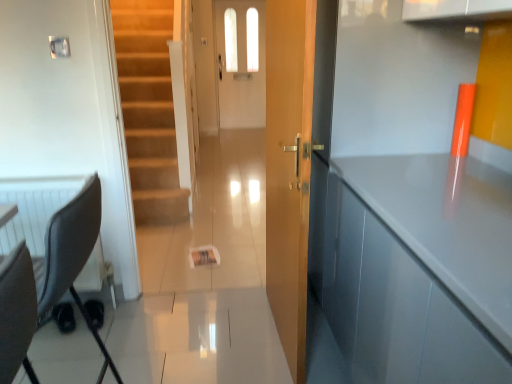
Question: From the image's perspective, does glossy gray cabinet at right appear higher than white glossy door at center?

Choices:
 (A) yes
 (B) no

Answer: (B)

Question: Is glossy gray cabinet at right shorter than white glossy door at center?

Choices:
 (A) no
 (B) yes

Answer: (B)

Question: Can white glossy door at center be found inside glossy gray cabinet at right?

Choices:
 (A) no
 (B) yes

Answer: (A)

Question: From a real-world perspective, does glossy gray cabinet at right sit lower than white glossy door at center?

Choices:
 (A) yes
 (B) no

Answer: (A)

Question: Does glossy gray cabinet at right have a greater height compared to white glossy door at center?

Choices:
 (A) yes
 (B) no

Answer: (B)

Question: Considering the positions of glossy gray cabinet at right and wooden door at center in the image, is glossy gray cabinet at right taller or shorter than wooden door at center?

Choices:
 (A) tall
 (B) short

Answer: (B)

Question: Considering the positions of glossy gray cabinet at right and wooden door at center in the image, is glossy gray cabinet at right wider or thinner than wooden door at center?

Choices:
 (A) thin
 (B) wide

Answer: (B)

Question: Is point (394, 278) positioned closer to the camera than point (304, 309)?

Choices:
 (A) closer
 (B) farther

Answer: (A)

Question: Based on their positions, is glossy gray cabinet at right located to the left or right of wooden door at center?

Choices:
 (A) left
 (B) right

Answer: (B)

Question: From a real-world perspective, is wooden door at center above or below glossy gray cabinet at right?

Choices:
 (A) above
 (B) below

Answer: (A)

Question: In the image, is wooden door at center positioned in front of or behind glossy gray cabinet at right?

Choices:
 (A) behind
 (B) front

Answer: (A)

Question: From the image's perspective, is wooden door at center located above or below glossy gray cabinet at right?

Choices:
 (A) below
 (B) above

Answer: (B)

Question: In terms of height, does wooden door at center look taller or shorter compared to glossy gray cabinet at right?

Choices:
 (A) short
 (B) tall

Answer: (B)

Question: From the image's perspective, is black fabric swivel chair at left located above or below wooden door at center?

Choices:
 (A) above
 (B) below

Answer: (B)

Question: Do you think black fabric swivel chair at left is within wooden door at center, or outside of it?

Choices:
 (A) outside
 (B) inside

Answer: (A)